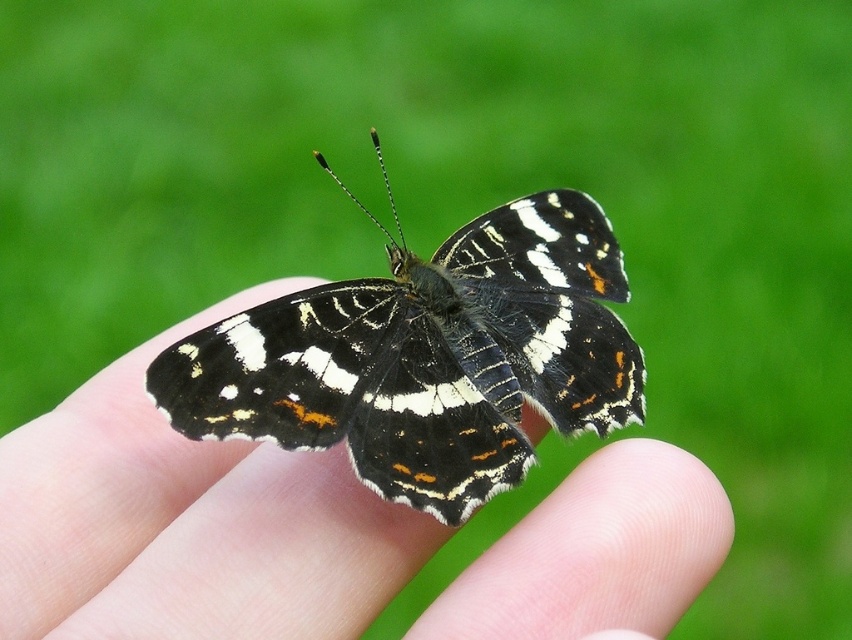
Question: Which of the following is the farthest from the observer?

Choices:
 (A) black and white butterfly at center
 (B) matte black butterfly at center

Answer: (A)

Question: Considering the relative positions of matte black butterfly at center and black and white butterfly at center in the image provided, where is matte black butterfly at center located with respect to black and white butterfly at center?

Choices:
 (A) right
 (B) left

Answer: (B)

Question: Does matte black butterfly at center have a smaller size compared to black and white butterfly at center?

Choices:
 (A) no
 (B) yes

Answer: (A)

Question: Is matte black butterfly at center above black and white butterfly at center?

Choices:
 (A) yes
 (B) no

Answer: (B)